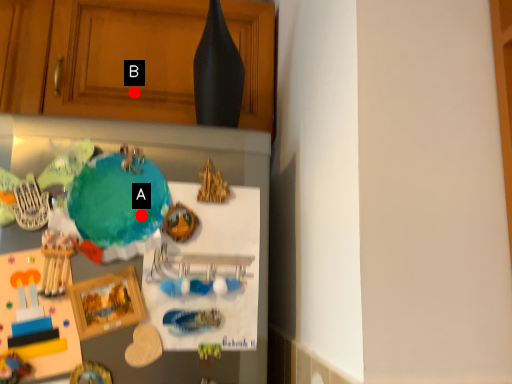
Question: Two points are circled on the image, labeled by A and B beside each circle. Which point appears farthest from the camera in this image?

Choices:
 (A) A is further
 (B) B is further

Answer: (B)